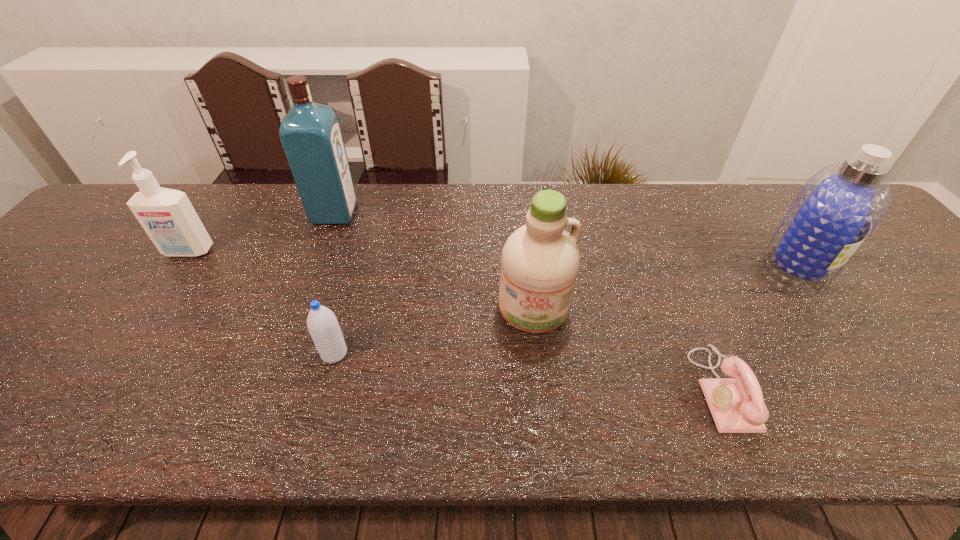
Where is `the farthest object`? Image resolution: width=960 pixels, height=540 pixels. the farthest object is located at coordinates (310, 133).

I want to click on the second object from left to right, so click(x=310, y=133).

Locate an element on the screen. The width and height of the screenshot is (960, 540). the rightmost object is located at coordinates (841, 205).

Where is `the second cleansing agent from left to right`? This screenshot has width=960, height=540. the second cleansing agent from left to right is located at coordinates (540, 260).

Find the location of a particular element. the leftmost object is located at coordinates (167, 216).

Image resolution: width=960 pixels, height=540 pixels. I want to click on water bottle, so pos(322,323).

You are a GUI agent. You are given a task and a screenshot of the screen. Output one action in this format:
    pyautogui.click(x=<x>, y=<y>)
    Task: Click on the third object from left to right
    
    Given the screenshot: What is the action you would take?
    [322, 323]

Locate an element on the screen. This screenshot has width=960, height=540. the fifth object from left to right is located at coordinates (737, 405).

At what (x,y) coordinates should I click in order to perform the action: click on telephone. Please return your answer as a coordinate pair (x, y). The image size is (960, 540). Looking at the image, I should click on (737, 405).

Locate an element on the screen. This screenshot has width=960, height=540. free space located 0.060m on the flat label side of the second object from left to right is located at coordinates (375, 213).